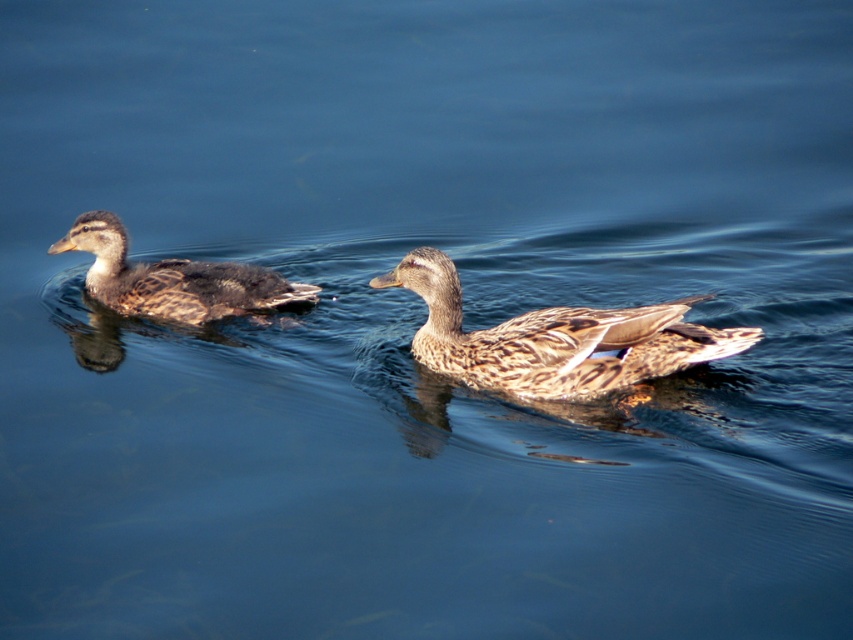
You are standing on the edge of a pond and see a point marked at coordinates (554, 339). Based on the scene, what object is located at that point?

The point at coordinates (554, 339) corresponds to the brown speckled duck at center.